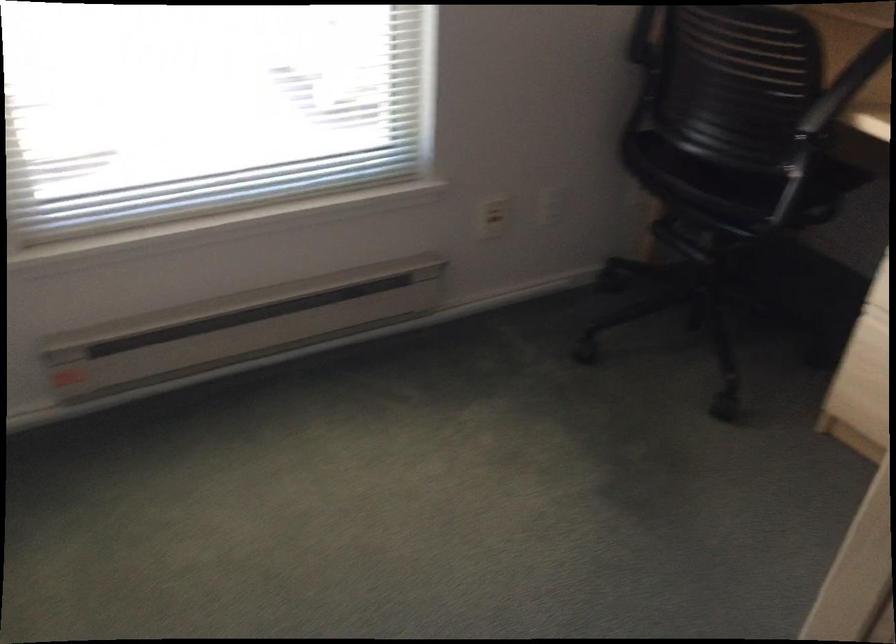
The height and width of the screenshot is (644, 896). What do you see at coordinates (846, 84) in the screenshot?
I see `the black chair armrest` at bounding box center [846, 84].